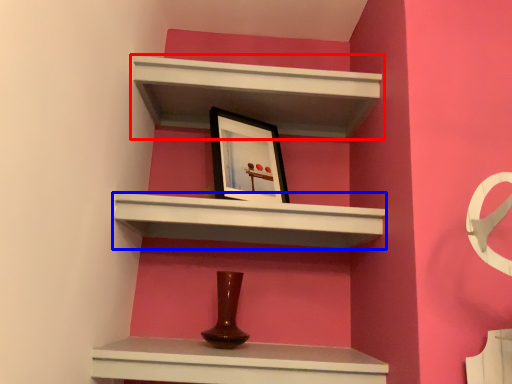
Question: Which object appears closest to the camera in this image, shelf (highlighted by a red box) or shelf (highlighted by a blue box)?

Choices:
 (A) shelf
 (B) shelf

Answer: (B)